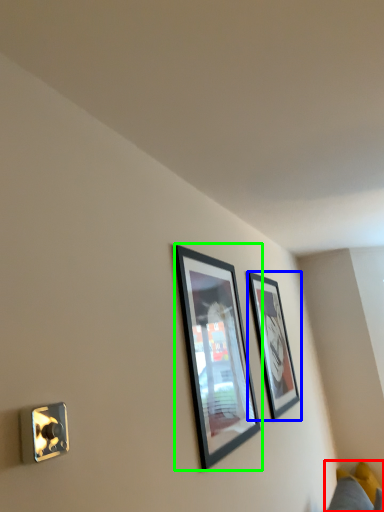
Question: Which is nearer to the couch (highlighted by a red box)? picture frame (highlighted by a blue box) or picture frame (highlighted by a green box).

Choices:
 (A) picture frame
 (B) picture frame

Answer: (A)